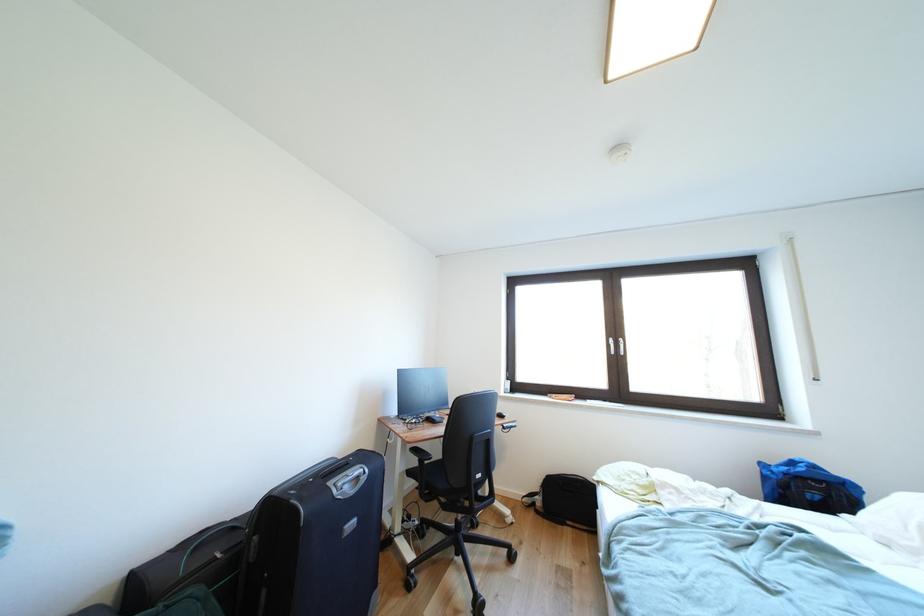
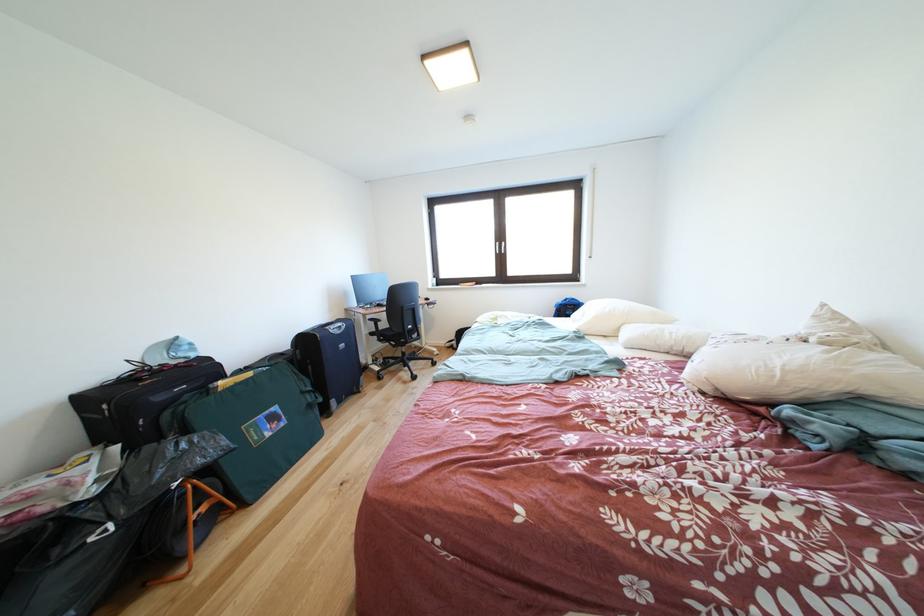
The point at (619,345) is marked in the first image. Where is the corresponding point in the second image?

(505, 249)